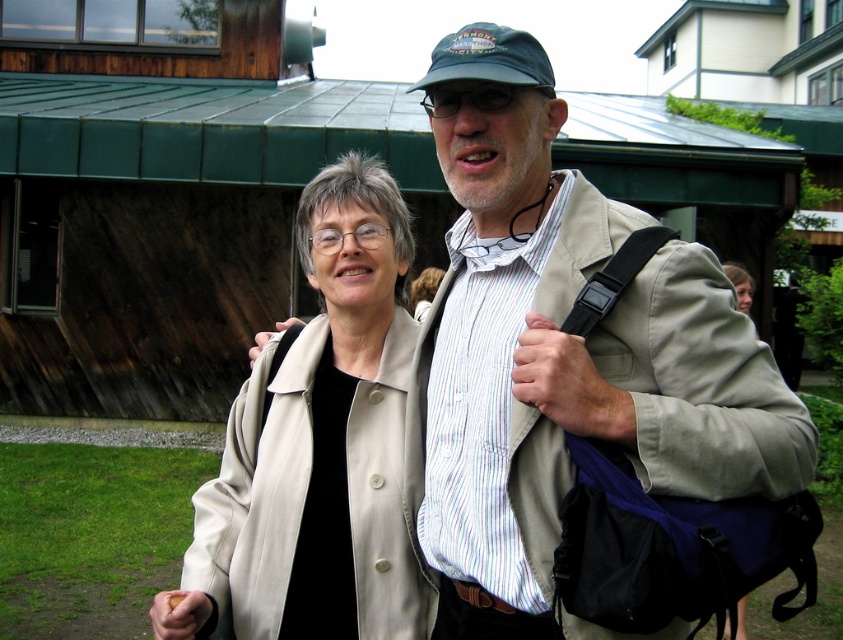
Question: Which point is farther from the camera taking this photo?

Choices:
 (A) (369, 500)
 (B) (753, 349)
 (C) (484, 42)

Answer: (A)

Question: Is beige fabric coat at center positioned behind beige fabric trench coat at center?

Choices:
 (A) yes
 (B) no

Answer: (A)

Question: Is beige fabric coat at center behind dark blue fabric baseball cap at upper center?

Choices:
 (A) yes
 (B) no

Answer: (A)

Question: Estimate the real-world distances between objects in this image. Which object is farther from the beige fabric coat at center?

Choices:
 (A) beige fabric trench coat at center
 (B) dark blue fabric baseball cap at upper center

Answer: (B)

Question: Among these objects, which one is farthest from the camera?

Choices:
 (A) beige fabric coat at center
 (B) dark blue fabric baseball cap at upper center
 (C) beige fabric trench coat at center

Answer: (A)

Question: Is beige fabric trench coat at center to the right of dark blue fabric baseball cap at upper center from the viewer's perspective?

Choices:
 (A) yes
 (B) no

Answer: (A)